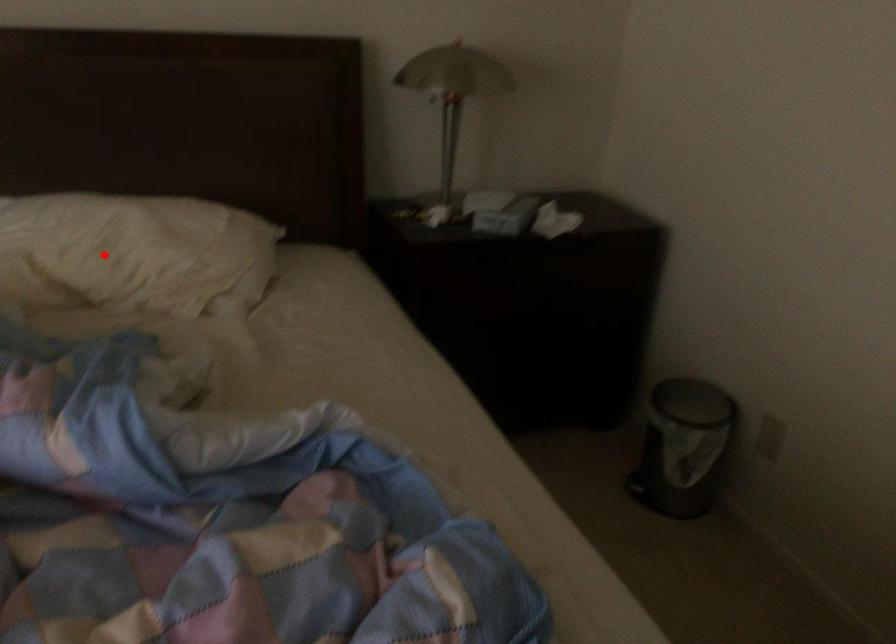
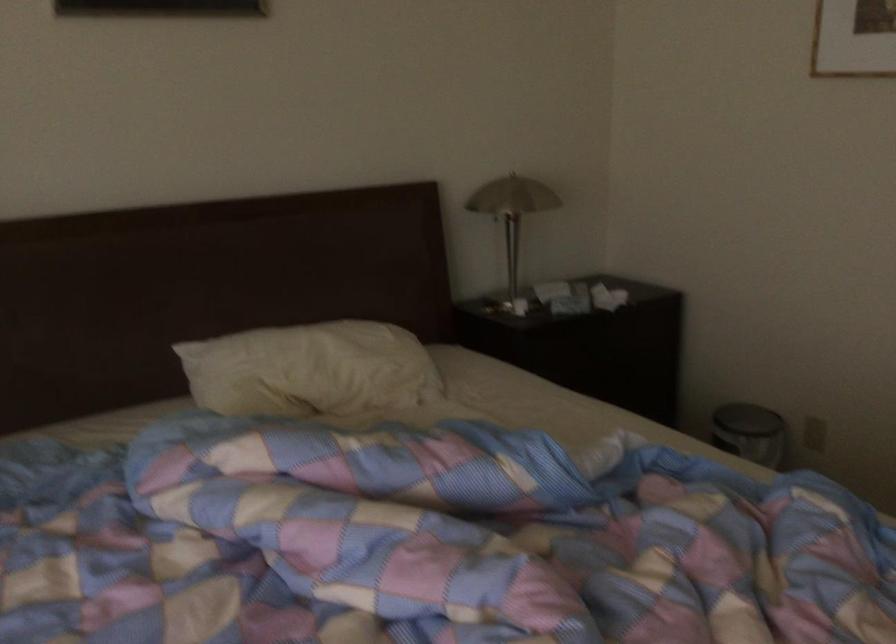
Question: I am providing you with two images of the same scene from different viewpoints. Image1 has a red point marked. In image2, the corresponding 3D location appears at what relative position? Reply with the corresponding letter.

Choices:
 (A) Closer
 (B) Farther

Answer: (B)